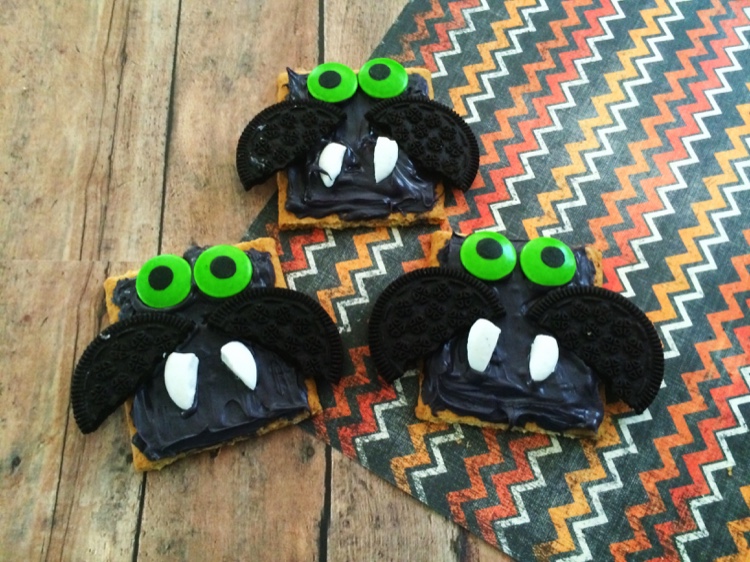
You are a GUI agent. You are given a task and a screenshot of the screen. Output one action in this format:
    pyautogui.click(x=<x>, y=<y>)
    Task: Click on the dark spots in boards
    Image resolution: width=750 pixels, height=562 pixels.
    Given the screenshot: What is the action you would take?
    pyautogui.click(x=304, y=454), pyautogui.click(x=28, y=318), pyautogui.click(x=247, y=61)